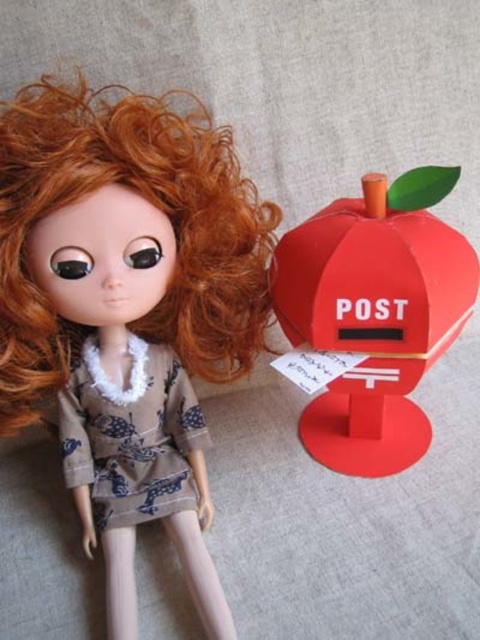
Where is the matte brown fabric doll at upper left located in the image?

The matte brown fabric doll at upper left is located at point (128, 310) in the image.

You are a photographer standing at a certain distance from the doll and the matte red mailbox at right. You want to take a photo where both the doll and the mailbox are in focus. The camera you are using has a depth of field that can cover 35 inches. Can you capture both subjects clearly in the same photo?

The matte red mailbox at right is 36.50 inches away from the camera. Since the depth of field can only cover 35 inches, the distance between the doll and the mailbox exceeds the camera settings, making it difficult to have both in focus simultaneously.